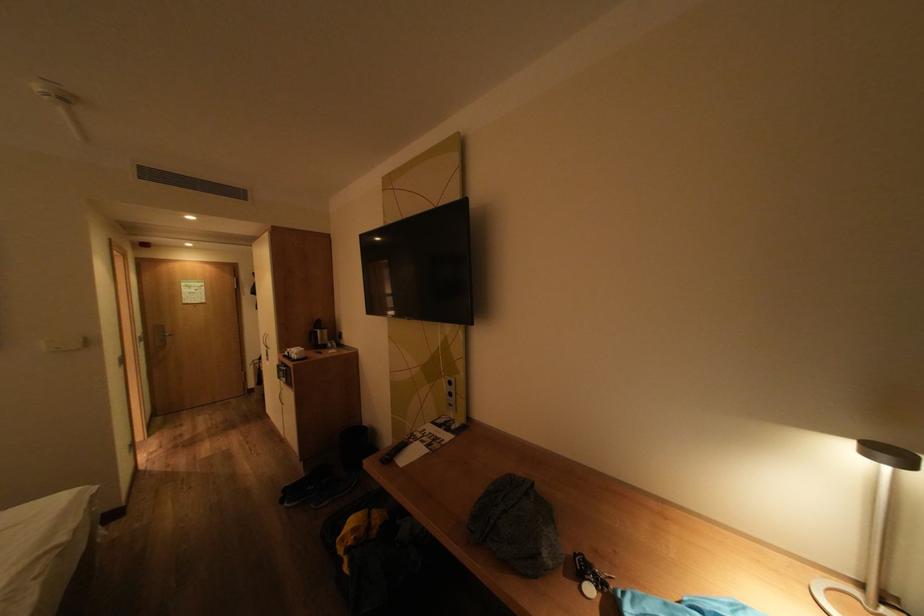
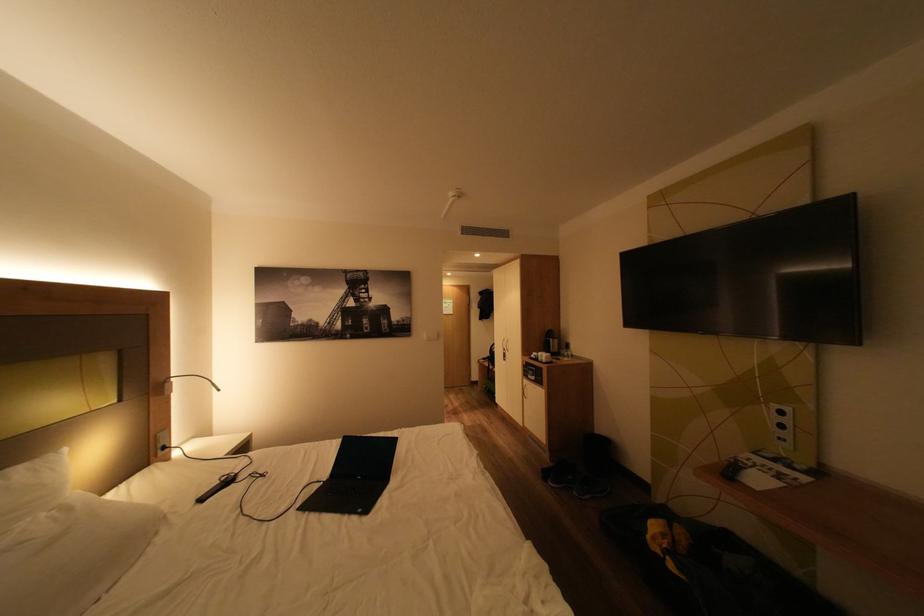
Question: The camera is either moving clockwise (left) or counter-clockwise (right) around the object. The first image is from the beginning of the video and the second image is from the end. Is the camera moving left or right when shooting the video?

Choices:
 (A) Left
 (B) Right

Answer: (B)